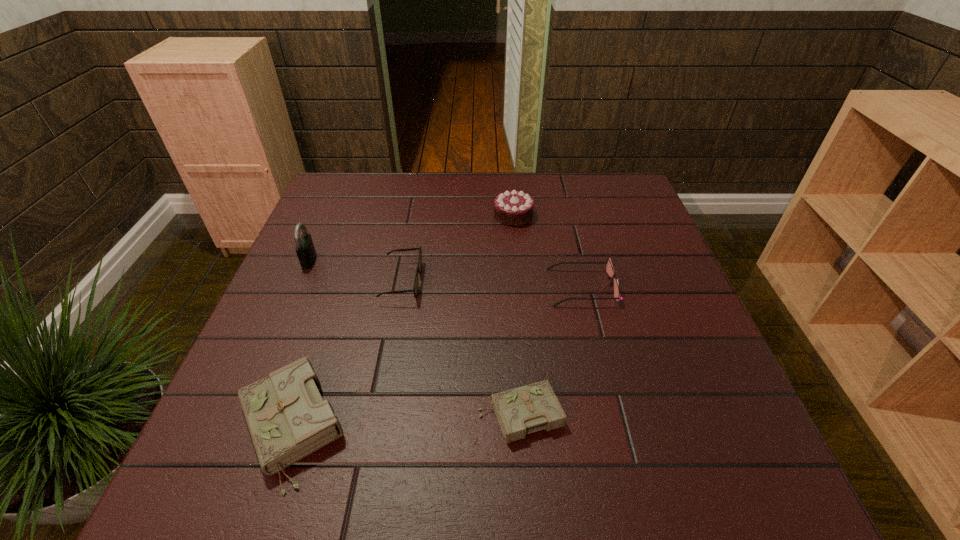
Locate an element on the screen. The width and height of the screenshot is (960, 540). vacant spot to place a diary on the right is located at coordinates (740, 402).